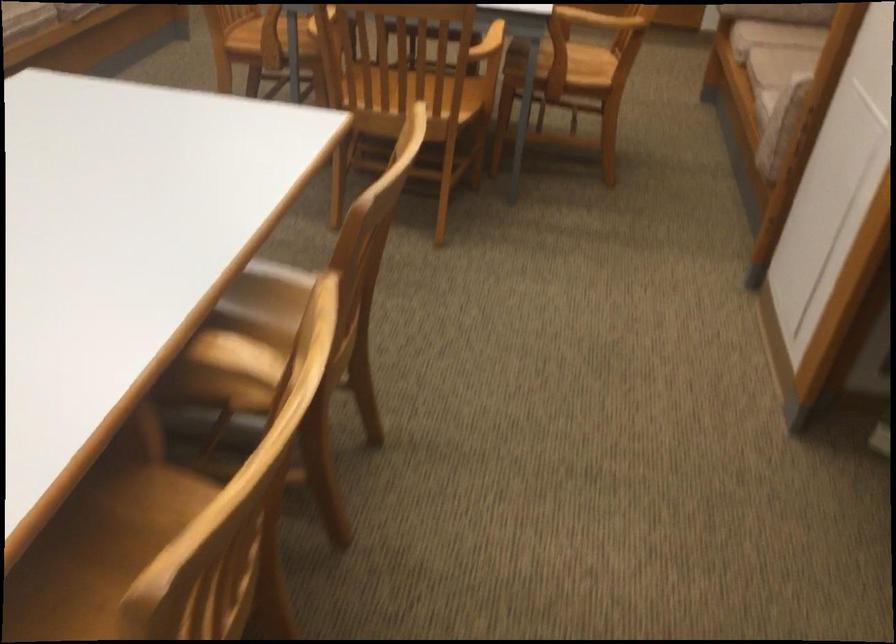
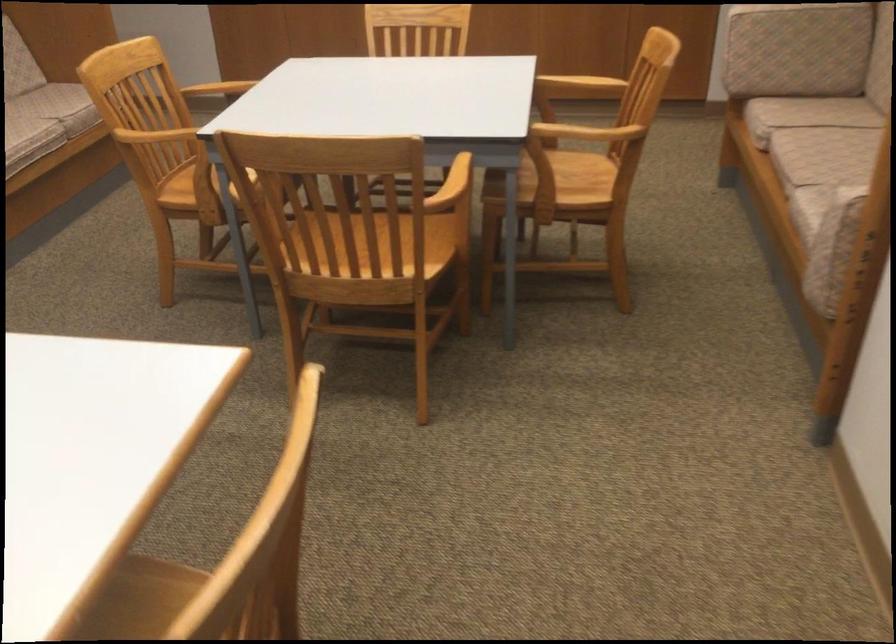
Find the pixel in the second image that matches the point at 400,93 in the first image.

(358, 259)